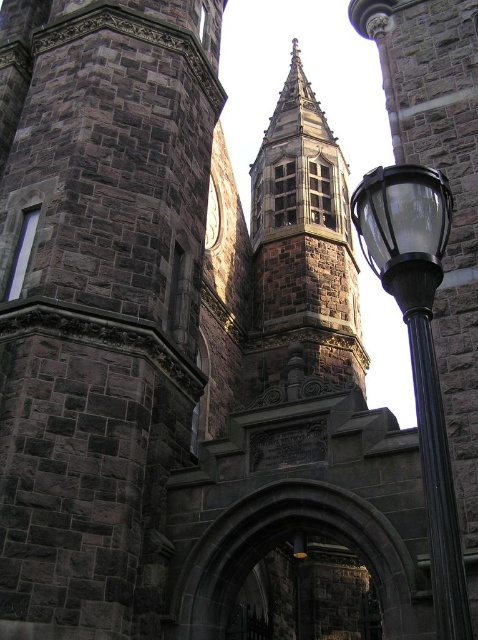
Question: Which object appears farthest from the camera in this image?

Choices:
 (A) brown stone church tower at center
 (B) black polished metal street light at right
 (C) dark stone archway at center

Answer: (A)

Question: Which point appears closest to the camera in this image?

Choices:
 (A) (436, 419)
 (B) (284, 180)
 (C) (47, 353)
 (D) (372, 560)

Answer: (A)

Question: Does dark gray stone tower at center appear over black polished metal street light at right?

Choices:
 (A) no
 (B) yes

Answer: (B)

Question: Is dark gray stone tower at center thinner than brown stone church tower at center?

Choices:
 (A) yes
 (B) no

Answer: (B)

Question: Which point appears closest to the camera in this image?

Choices:
 (A) (73, 170)
 (B) (455, 506)
 (C) (184, 566)

Answer: (B)

Question: Can you confirm if dark stone archway at center is positioned below black polished pole at right?

Choices:
 (A) yes
 (B) no

Answer: (A)